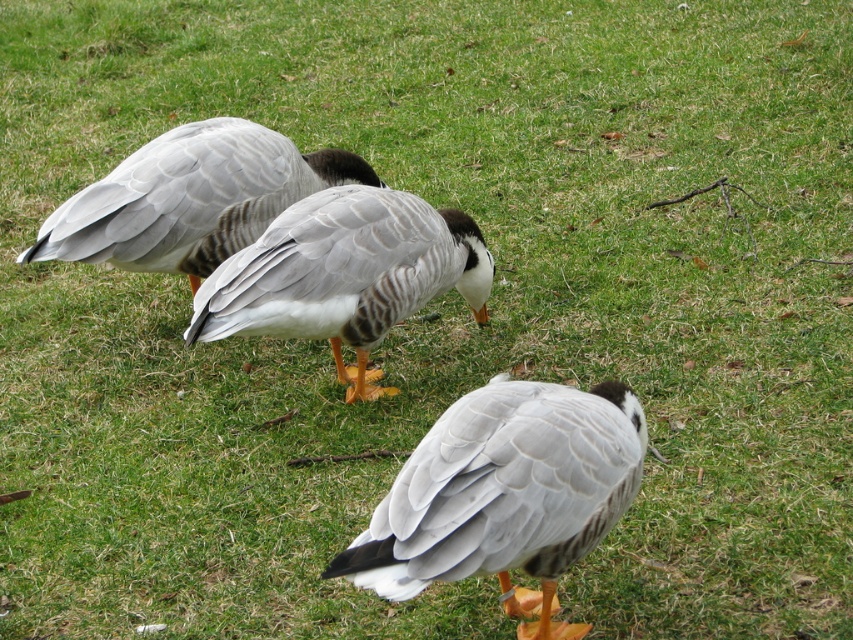
Is white feathered duck at center above gray feathered duck at center?

No.

Is white feathered duck at center taller than gray feathered duck at center?

In fact, white feathered duck at center may be shorter than gray feathered duck at center.

Who is more distant from viewer, (519,435) or (271,243)?

Positioned behind is point (271,243).

This screenshot has height=640, width=853. In order to click on white feathered duck at center in this screenshot , I will do `click(503, 492)`.

From the picture: Who is more forward, (x=251, y=243) or (x=344, y=164)?

Positioned in front is point (x=251, y=243).

Who is positioned more to the left, gray feathered duck at center or gray matte duck at upper left?

Positioned to the left is gray matte duck at upper left.

I want to click on gray feathered duck at center, so click(345, 275).

Is white feathered duck at center smaller than gray matte duck at upper left?

Yes, white feathered duck at center is smaller than gray matte duck at upper left.

Which is behind, point (421, 465) or point (242, 144)?

Positioned behind is point (242, 144).

This screenshot has height=640, width=853. In order to click on white feathered duck at center in this screenshot , I will do `click(503, 492)`.